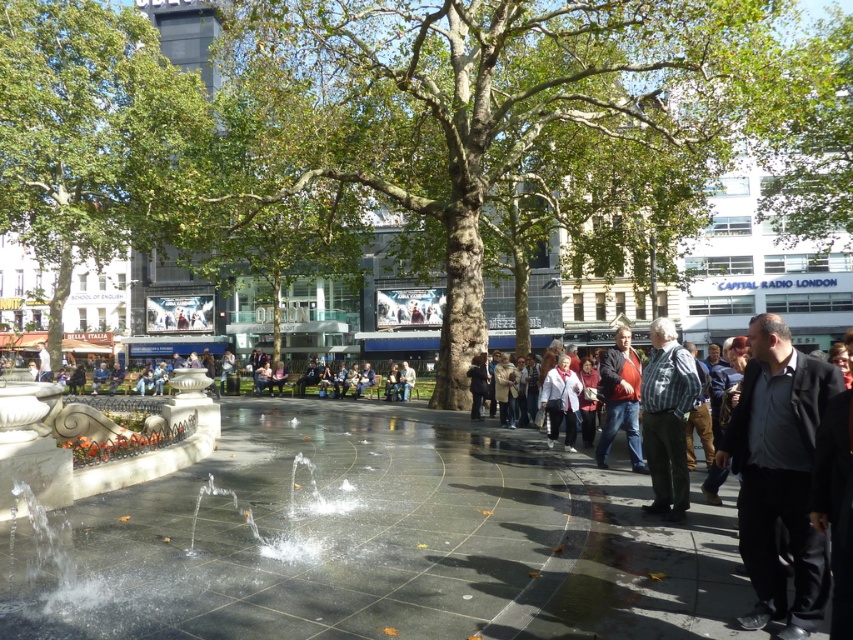
Does point (643, 442) come farther from viewer compared to point (634, 417)?

That is False.

Does striped cotton shirt at center-right have a greater height compared to dark brown leather jacket at center?

Correct, striped cotton shirt at center-right is much taller as dark brown leather jacket at center.

The image size is (853, 640). Identify the location of striped cotton shirt at center-right. (666, 419).

Does point (805, 493) come closer to viewer compared to point (572, 413)?

Yes.

Locate an element on the screen. black matte jacket at right is located at coordinates (778, 474).

Is green leafy tree at upper left closer to camera compared to white matte jacket at center?

No, it is not.

Is green leafy tree at upper left thinner than white matte jacket at center?

No.

The image size is (853, 640). Identify the location of green leafy tree at upper left. (88, 134).